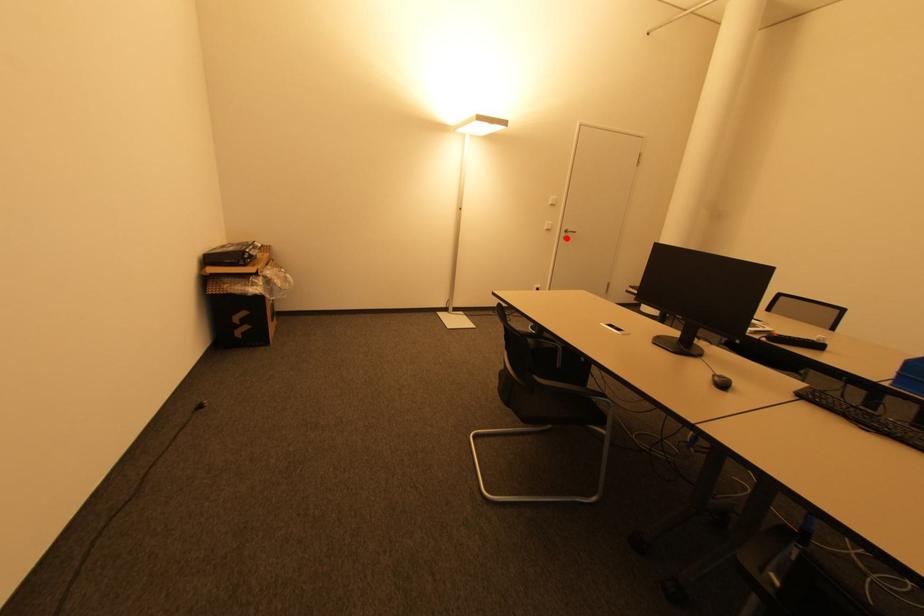
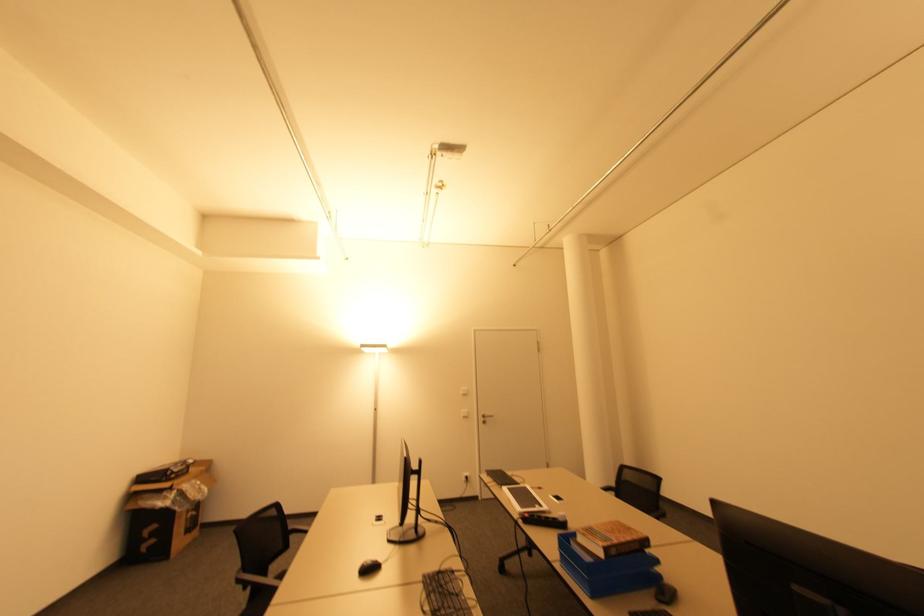
Question: I am providing you with two images of the same scene from different viewpoints. A red point is marked on the first image. Can you still see the location of the red point in image 2?

Choices:
 (A) Yes
 (B) No

Answer: (A)